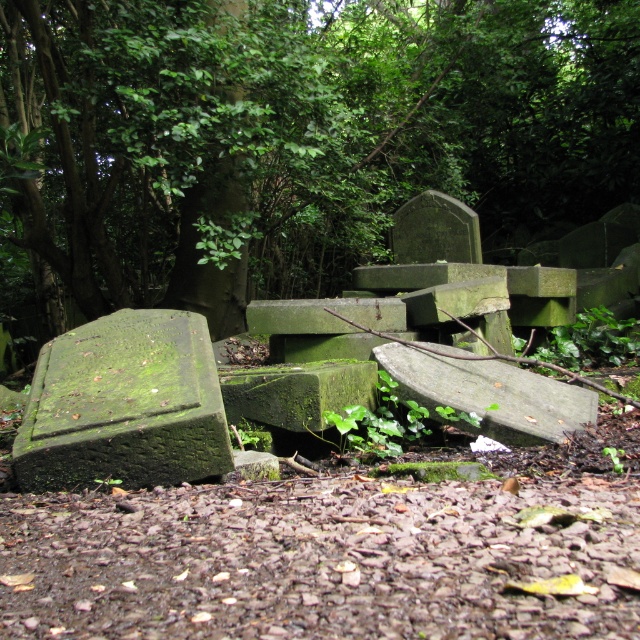
You are a groundskeeper tasked with maintaining the cemetery. You need to place a new decorative stone between the green mossy tombstone at center and the green mossy gravestone at lower left. Which of the two objects should you position the new stone closer to in order to ensure it fits within the available space?

The green mossy tombstone at center has a lesser width compared to the green mossy gravestone at lower left, so positioning the new decorative stone closer to the green mossy tombstone at center would allow it to fit within the available space.

You are standing at the entrance of the cemetery and want to locate the green mossy tombstone at center. According to the coordinates provided, where should you look relative to your current position?

The green mossy tombstone at center is located at coordinates 0.216 on the x axis and 0.459 on the y axis, so you should look to the left and slightly forward from your current position at the entrance.

You are a groundskeeper tasked with clearing the area between the green mossy tombstone at center and the green mossy gravestone at lower left. Can you walk directly between them without stepping on either?

The green mossy tombstone at center is positioned over the green mossy gravestone at lower left, meaning they are stacked or one is directly above the other. This makes it impossible to walk between them as they occupy the same space vertically.